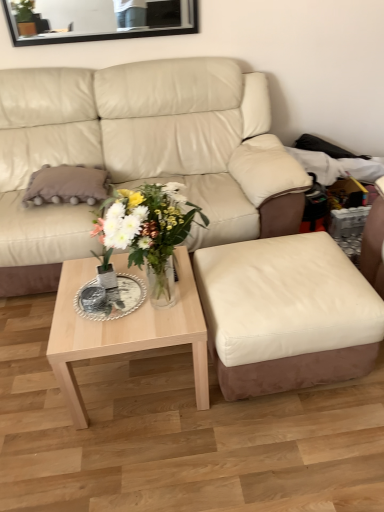
Find the location of a particular element. vacant space in black glass mirror at upper center (from a real-world perspective) is located at coordinates pyautogui.click(x=81, y=57).